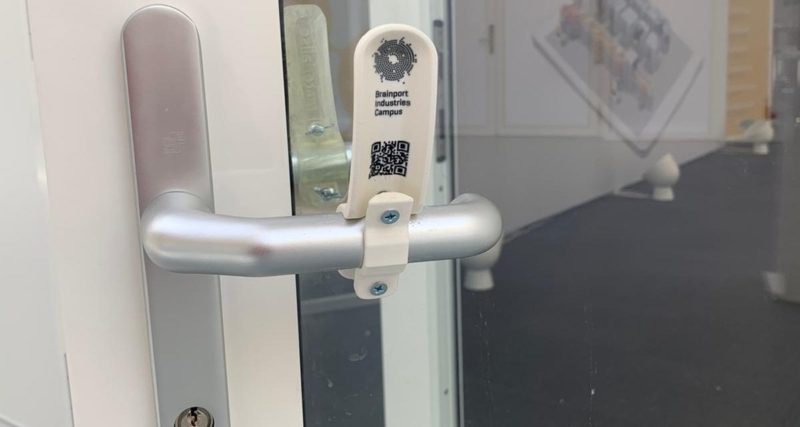
This screenshot has width=800, height=427. I want to click on screws, so click(x=325, y=190), click(x=316, y=124), click(x=378, y=287), click(x=386, y=218).